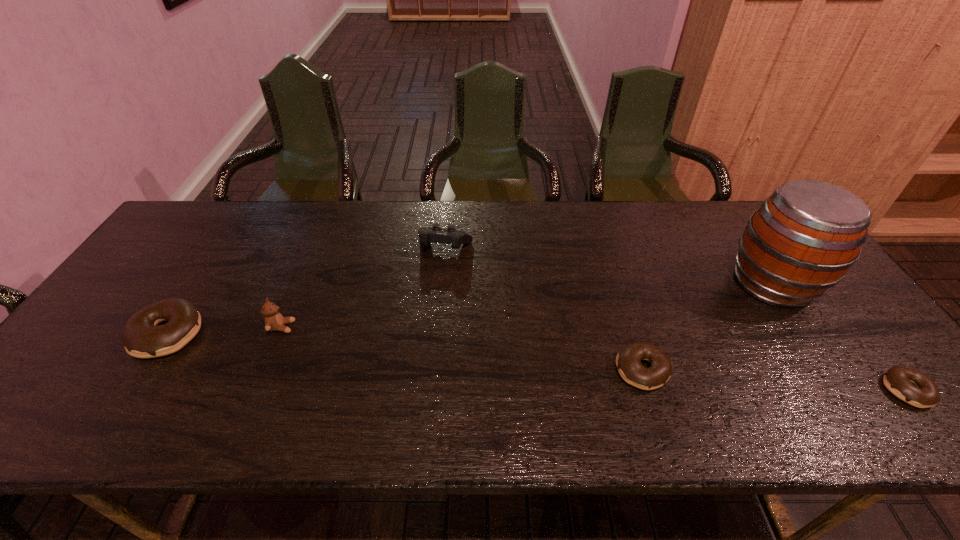
If equal spacing is desired by inserting an extra doughnut among them, please point out a free spot for this new doughnut. Please provide its 2D coordinates. Your answer should be formatted as a tuple, i.e. [(x, y)], where the tuple contains the x and y coordinates of a point satisfying the conditions above.

[(396, 351)]